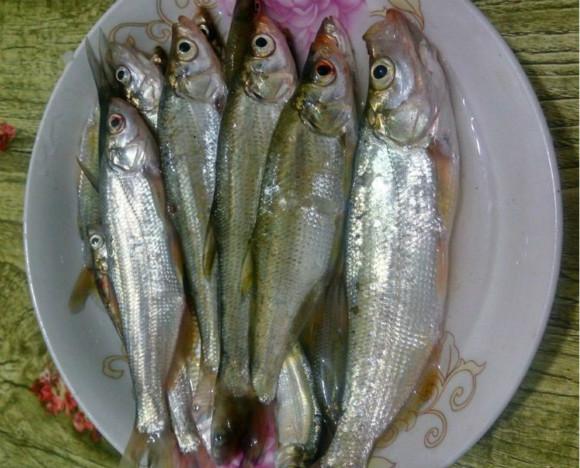
Find the location of a particular element. table is located at coordinates (25, 297).